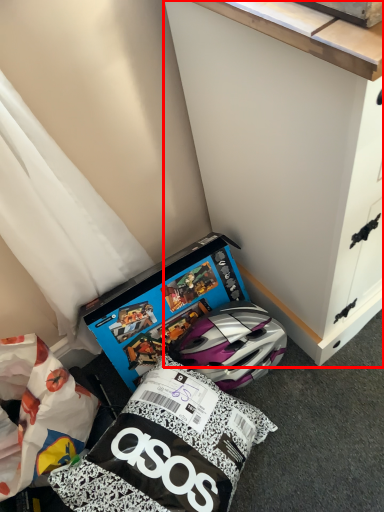
Question: From the image's perspective, where is cabinetry (annotated by the red box) located relative to box?

Choices:
 (A) above
 (B) below

Answer: (A)